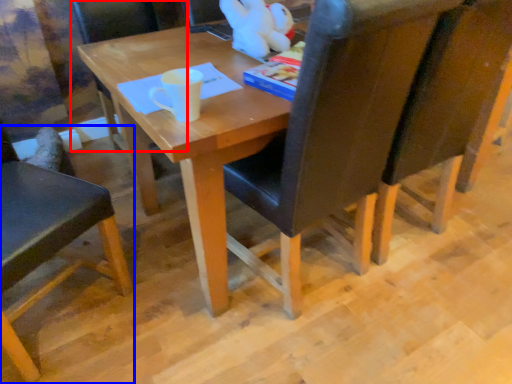
Question: Which object is further to the camera taking this photo, chair (highlighted by a red box) or chair (highlighted by a blue box)?

Choices:
 (A) chair
 (B) chair

Answer: (A)